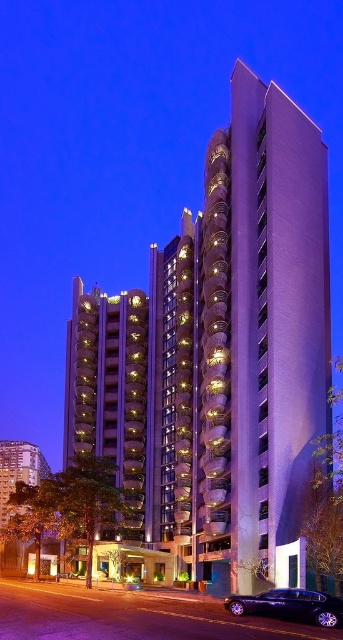
You are standing in front of the modern highrise building at twilight. There is a point marked at coordinates (263, 326). What does this point indicate?

The point at (263, 326) marks the purple smooth building at center.

You are a delivery driver approaching the shiny black sedan at lower right and the purple smooth building at center. Which object is closer to you from your current position?

The shiny black sedan at lower right is closer to you because it is positioned below the purple smooth building at center, which is located above it.

Looking at this image, you are standing on the sidewalk in front of the purple smooth building at center. You want to see the shiny black sedan at lower right. Can you see it from your current position?

The shiny black sedan at lower right is behind the purple smooth building at center, so you cannot see it from your current position on the sidewalk in front of the purple smooth building at center.